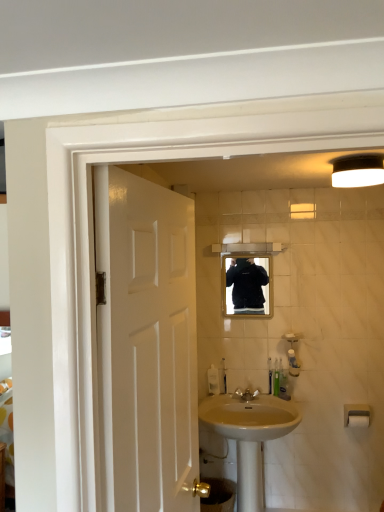
Question: Does white plastic toothbrush at lower center, which is the first toiletry from left to right, have a greater width compared to polished brass faucet at sink center?

Choices:
 (A) no
 (B) yes

Answer: (A)

Question: Is white plastic toothbrush at lower center, which is the first toiletry from left to right, outside polished brass faucet at sink center?

Choices:
 (A) yes
 (B) no

Answer: (A)

Question: Does white plastic toothbrush at lower center, which is the first toiletry from left to right, have a smaller size compared to polished brass faucet at sink center?

Choices:
 (A) yes
 (B) no

Answer: (A)

Question: Would you consider white plastic toothbrush at lower center, arranged as the fourth toiletry when viewed from the right, to be distant from polished brass faucet at sink center?

Choices:
 (A) yes
 (B) no

Answer: (B)

Question: Is white plastic toothbrush at lower center, arranged as the fourth toiletry when viewed from the right, looking in the opposite direction of polished brass faucet at sink center?

Choices:
 (A) no
 (B) yes

Answer: (A)

Question: Is white plastic toothbrush at lower center, which is the first toiletry from left to right, to the right of polished brass faucet at sink center from the viewer's perspective?

Choices:
 (A) yes
 (B) no

Answer: (B)

Question: Can you confirm if white plastic towel bar at lower right, which is counted as the second towel bar, starting from the bottom, is wider than white plastic towel bar at lower right, which is the 1th towel bar in bottom-to-top order?

Choices:
 (A) yes
 (B) no

Answer: (A)

Question: From the image's perspective, is white plastic towel bar at lower right, positioned as the 1th towel bar in top-to-bottom order, on white plastic towel bar at lower right, which is the 1th towel bar in bottom-to-top order?

Choices:
 (A) yes
 (B) no

Answer: (A)

Question: From a real-world perspective, is white plastic towel bar at lower right, positioned as the 1th towel bar in top-to-bottom order, beneath white plastic towel bar at lower right, which appears as the second towel bar when viewed from the top?

Choices:
 (A) yes
 (B) no

Answer: (B)

Question: Can you confirm if white plastic towel bar at lower right, which is counted as the second towel bar, starting from the bottom, is taller than white plastic towel bar at lower right, which is the 1th towel bar in bottom-to-top order?

Choices:
 (A) yes
 (B) no

Answer: (A)

Question: Does white plastic towel bar at lower right, which is counted as the second towel bar, starting from the bottom, turn towards white plastic towel bar at lower right, which is the 1th towel bar in bottom-to-top order?

Choices:
 (A) yes
 (B) no

Answer: (A)

Question: Does white plastic towel bar at lower right, positioned as the 1th towel bar in top-to-bottom order, appear on the left side of white plastic towel bar at lower right, which is the 1th towel bar in bottom-to-top order?

Choices:
 (A) yes
 (B) no

Answer: (A)

Question: Is white glossy door at left facing away from translucent plastic bottle at lower center, which appears as the third toiletry when viewed from the left?

Choices:
 (A) yes
 (B) no

Answer: (B)